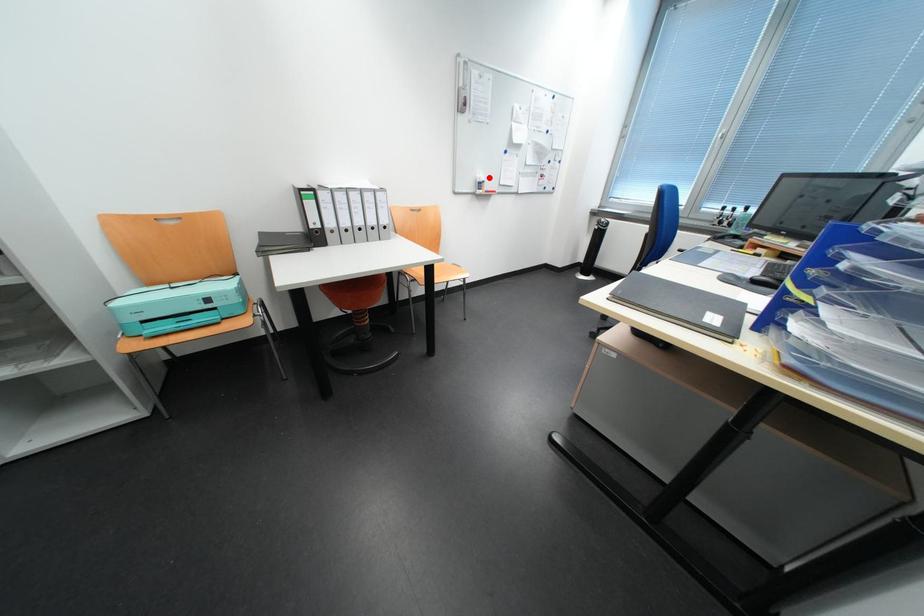
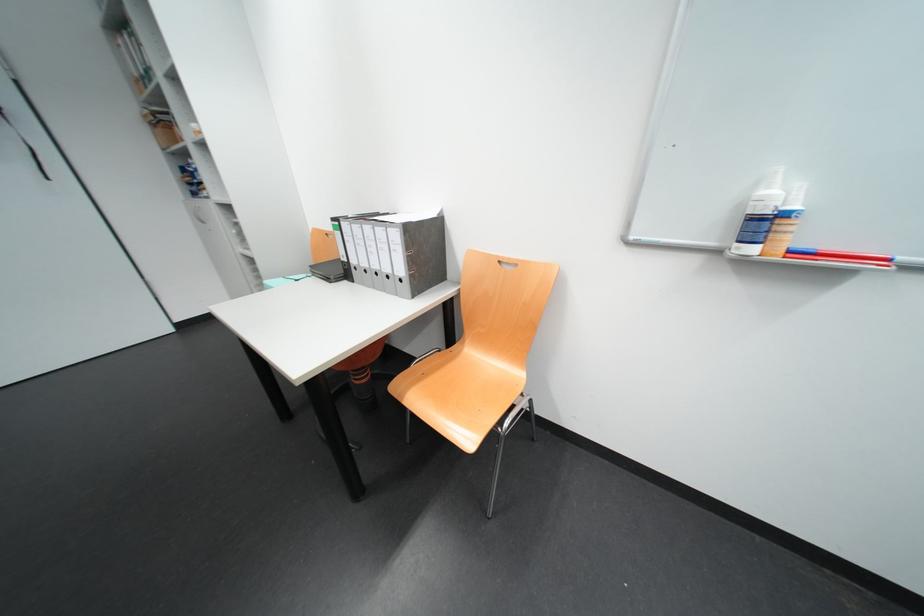
Question: I am providing you with two images of the same scene from different viewpoints. A red point is shown in image1. For the corresponding object point in image2, is it positioned nearer or farther from the camera?

Choices:
 (A) Nearer
 (B) Farther

Answer: (B)